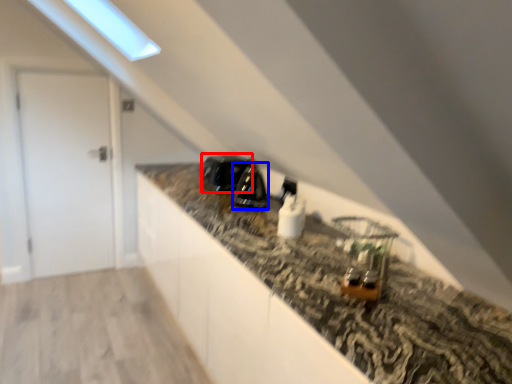
Question: Which of the following is the closest to the observer, appliance (highlighted by a red box) or appliance (highlighted by a blue box)?

Choices:
 (A) appliance
 (B) appliance

Answer: (B)